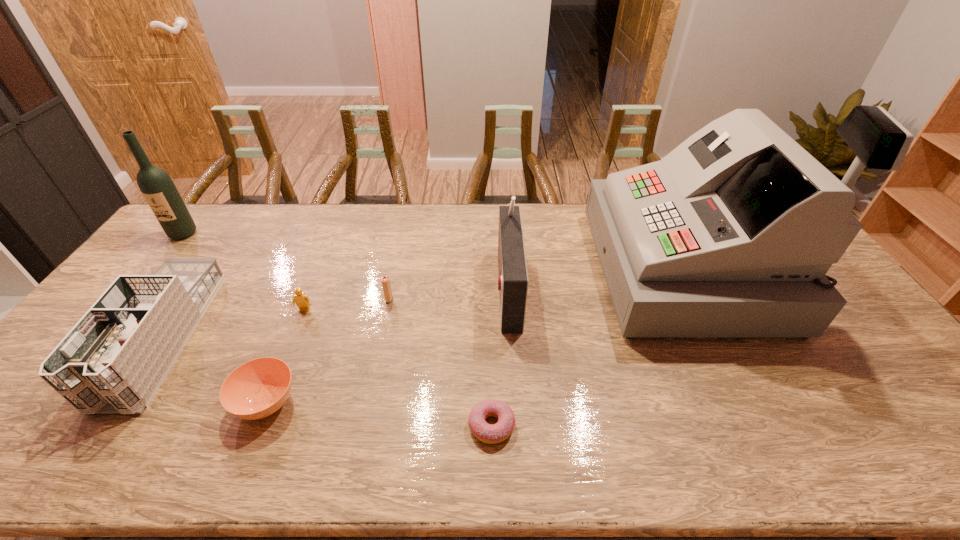
Find the location of a particular element. This screenshot has height=540, width=960. cash register is located at coordinates (731, 234).

I want to click on the rightmost object, so click(x=731, y=234).

Locate an element on the screen. The image size is (960, 540). wine bottle is located at coordinates (157, 187).

The image size is (960, 540). I want to click on the seventh shortest object, so click(x=157, y=187).

What are the coordinates of `the sixth shortest object` in the screenshot? It's located at (513, 281).

Identify the location of dollhouse. The width and height of the screenshot is (960, 540). (113, 361).

Find the location of a particular element. This screenshot has width=960, height=540. the second object from left to right is located at coordinates (113, 361).

The image size is (960, 540). Find the location of `igniter`. igniter is located at coordinates (385, 280).

In order to click on Lego in this screenshot , I will do `click(302, 301)`.

Identify the location of soup bowl. The width and height of the screenshot is (960, 540). pyautogui.click(x=258, y=388).